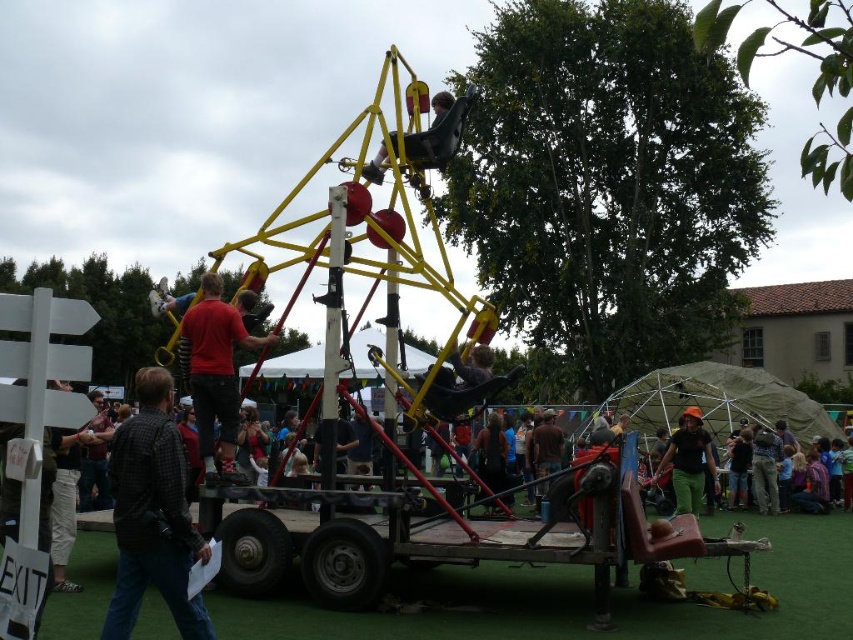
Measure the distance from black checkered shirt at center to green fabric hat at center.

77.93 feet

Can you confirm if black checkered shirt at center is bigger than green fabric hat at center?

Correct, black checkered shirt at center is larger in size than green fabric hat at center.

Does point (187, 538) come farther from viewer compared to point (663, 458)?

No.

This screenshot has width=853, height=640. Find the location of `black checkered shirt at center`. black checkered shirt at center is located at coordinates (152, 515).

Between red shirt at center and green fabric hat at center, which one has more height?

red shirt at center

This screenshot has height=640, width=853. In order to click on red shirt at center in this screenshot , I will do `click(213, 369)`.

In order to click on red shirt at center in this screenshot , I will do `click(213, 369)`.

Is the position of black checkered shirt at center more distant than that of red shirt at center?

That is False.

Measure the distance between point (x=119, y=481) and camera.

The distance of point (x=119, y=481) from camera is 15.75 meters.

Which is in front, point (122, 481) or point (224, 362)?

Point (122, 481) is more forward.

I want to click on black checkered shirt at center, so click(152, 515).